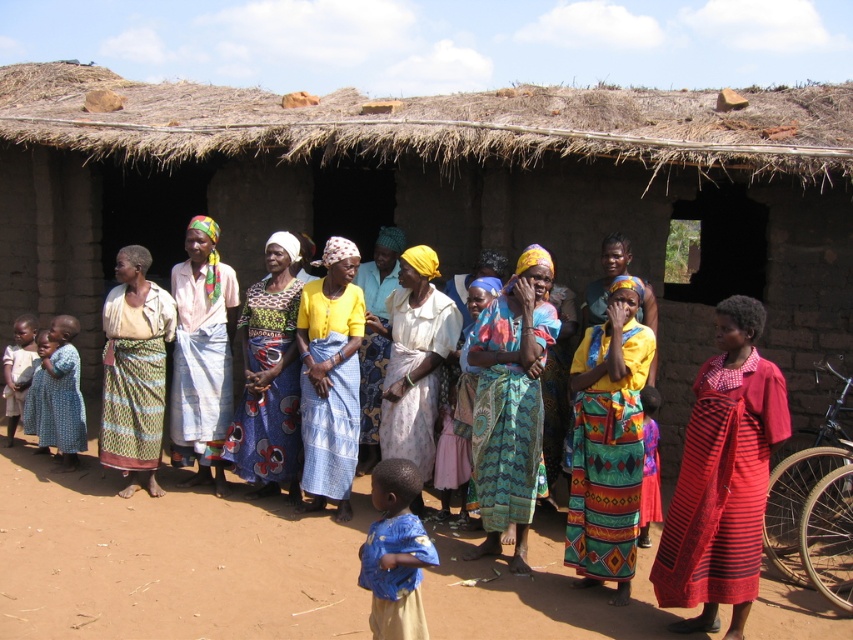
You are an anthropologist observing the scene and want to compare the clothing items. Which of the two items at center has a greater width? The multicolored woven skirt at center or the printed cotton dress at center?

The multicolored woven skirt at center has a greater width than the printed cotton dress at center.

You are a photographer taking a picture of the scene. You want to ensure both the printed cotton dress at center and the blue cotton dress at lower left are visible in the frame. Based on their positions, which dress should you focus on first to capture both in the shot?

The printed cotton dress at center is located above the blue cotton dress at lower left, so focusing on the printed cotton dress at center first will help ensure both are visible in the frame since it is positioned higher up.

You are a photographer trying to capture the scene of the women and children outside the traditional mud brick structure. You notice the printed cotton dress at center and the blue cotton dress at lower left. Which dress is positioned more to the right side of the image?

The printed cotton dress at center is positioned to the right of the blue cotton dress at lower left, so the printed cotton dress at center is more to the right side of the image.